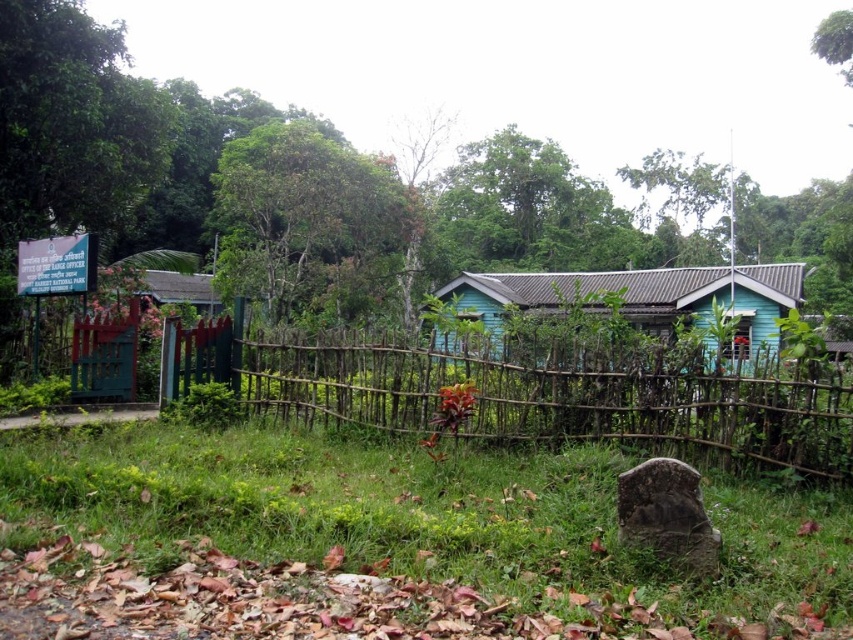
Who is positioned more to the left, green grass at center or brown wooden fence at center?

From the viewer's perspective, green grass at center appears more on the left side.

Which is above, green grass at center or brown wooden fence at center?

brown wooden fence at center is higher up.

Is point (532, 476) behind point (699, 388)?

No, it is in front of (699, 388).

Where is `green grass at center`? This screenshot has width=853, height=640. green grass at center is located at coordinates (427, 513).

Which of these two, brown wooden fence at center or blue wooden hut at center, stands taller?

blue wooden hut at center

The image size is (853, 640). Find the location of `brown wooden fence at center`. brown wooden fence at center is located at coordinates (523, 394).

I want to click on brown wooden fence at center, so click(523, 394).

Find the location of `brown wooden fence at center`. brown wooden fence at center is located at coordinates (523, 394).

Based on the photo, does green grass at center appear on the right side of blue wooden hut at center?

Incorrect, green grass at center is not on the right side of blue wooden hut at center.

Can you confirm if green grass at center is wider than blue wooden hut at center?

Incorrect, green grass at center's width does not surpass blue wooden hut at center's.

Between point (28, 477) and point (755, 275), which one is positioned behind?

The point (755, 275) is more distant.

The image size is (853, 640). What are the coordinates of `green grass at center` in the screenshot? It's located at (427, 513).